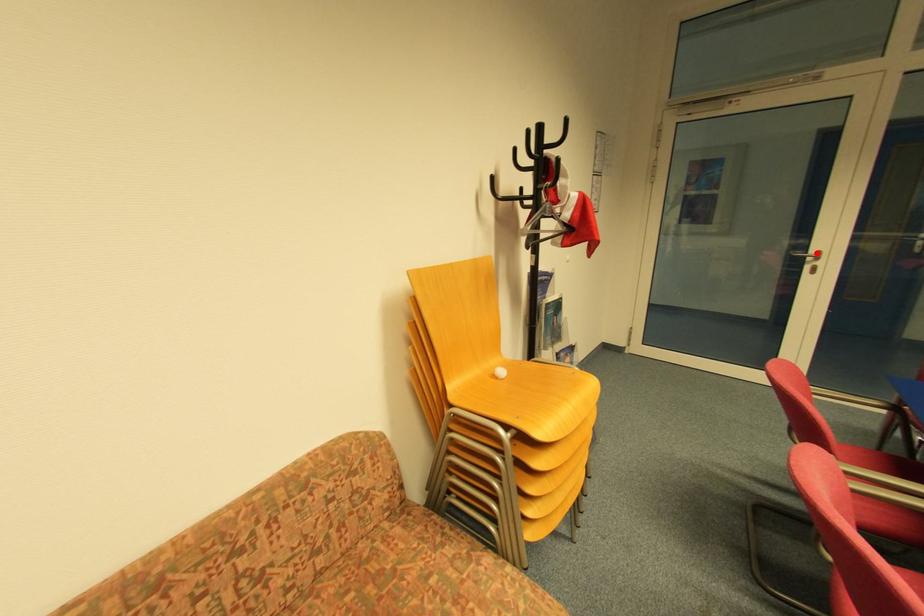
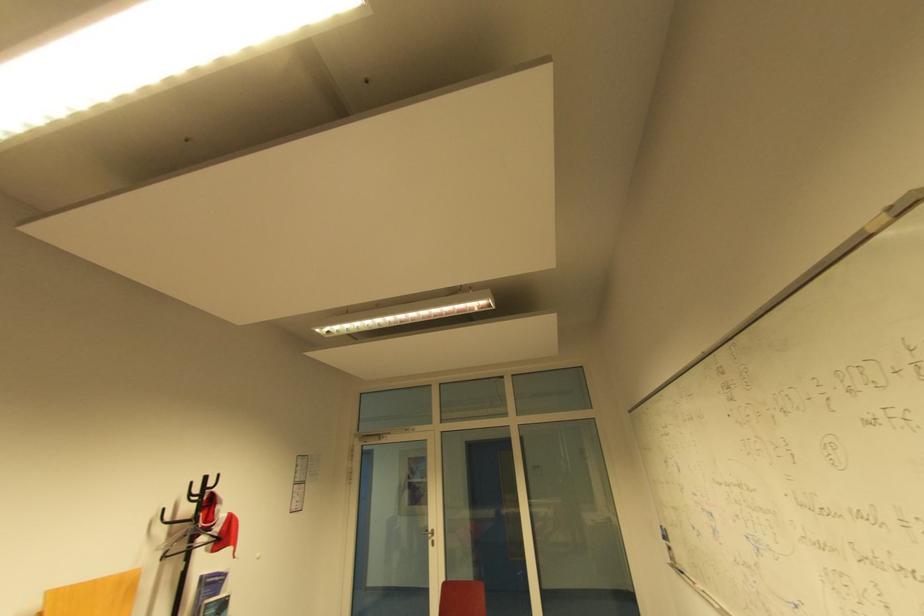
Locate, in the second image, the point that corresponds to the highlighted location in the first image.

(434, 531)